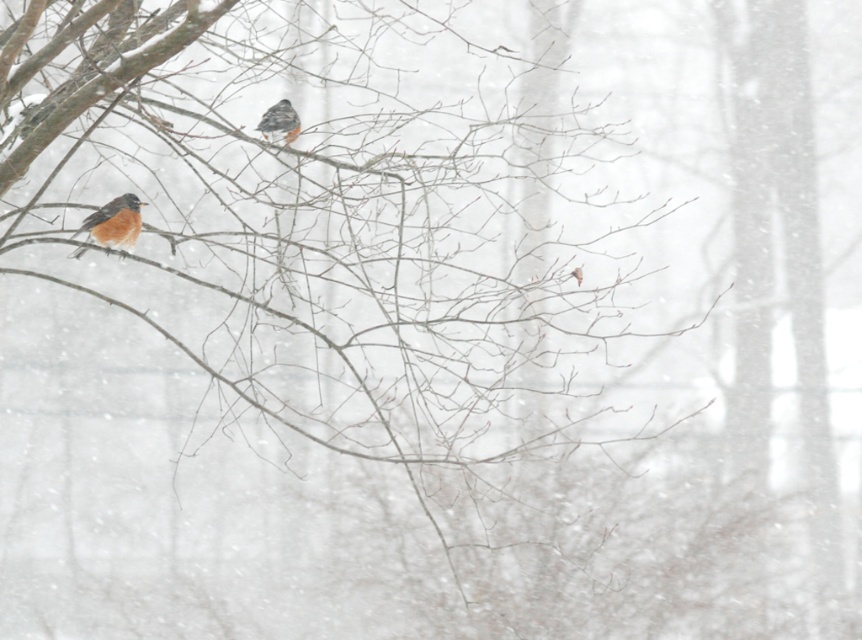
You are an ornithologist studying bird positions in winter scenes. You observe the bright orange bird at left in the image. What are its exact 2D coordinates in the scene?

The bright orange bird at left is located at the 2D coordinates of point (114, 221).

You are a birdwatcher trying to observe both the bright orange bird at left and the speckled feathered bird at upper center. If your binoculars have a minimum focusing distance of 1 meter, can you clearly see both birds with the same setting?

The bright orange bird at left is 1.06 meters away from the speckled feathered bird at upper center. Since the minimum focusing distance is 1 meter, the binoculars can adjust to focus on both birds as the distance between them is just over 1 meter, allowing for clear viewing with proper adjustment.

You are an ornithologist observing two birds in a snowy forest. You see the bright orange bird at left and the speckled feathered bird at upper center. Which bird is closer to you?

The bright orange bird at left is closer to you because it is in front of the speckled feathered bird at upper center.